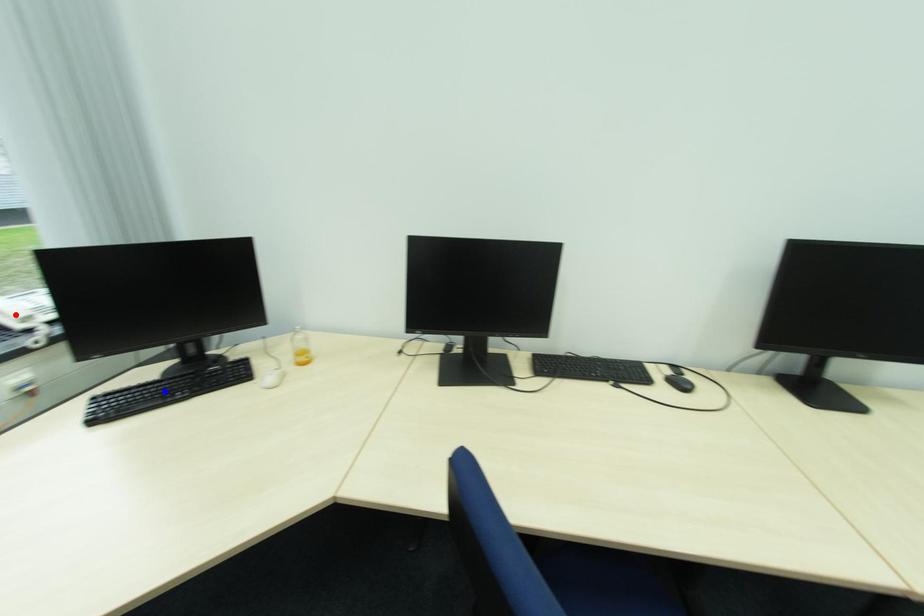
Question: Two points are marked on the image. Which point is closer to the camera?

Choices:
 (A) Blue point is closer.
 (B) Red point is closer.

Answer: (A)